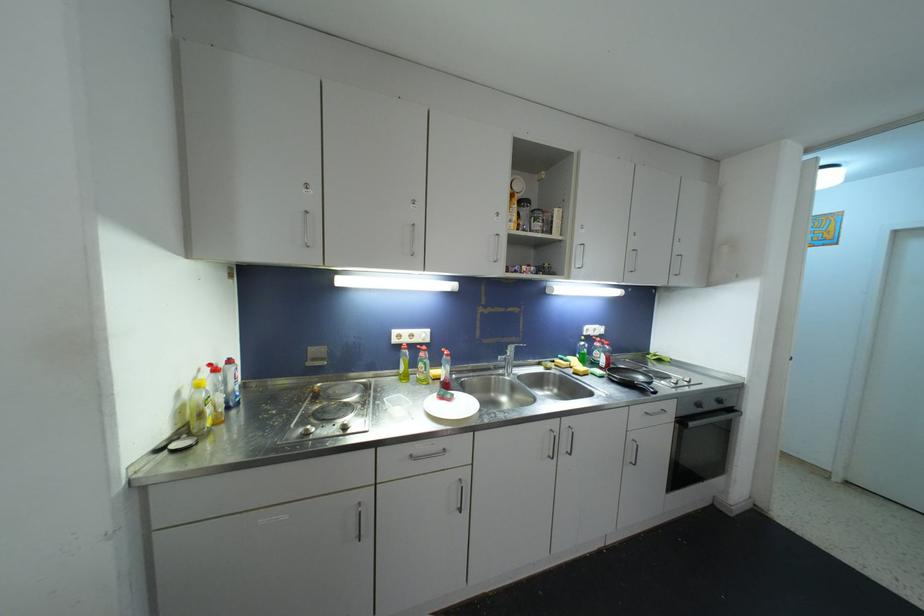
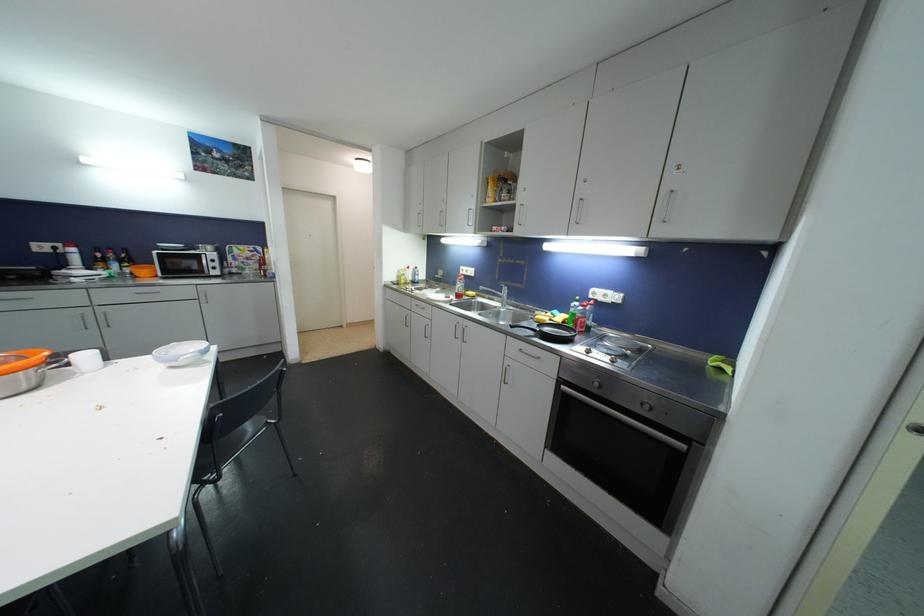
The point at (488, 344) is marked in the first image. Where is the corresponding point in the second image?

(504, 285)